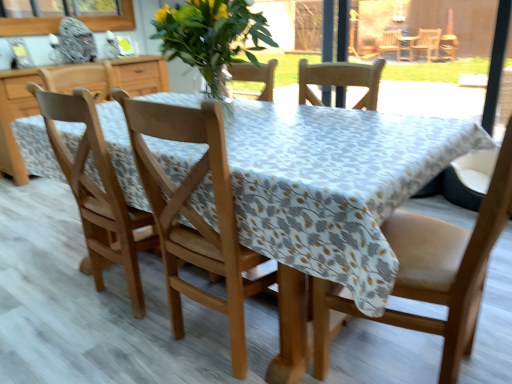
Question: From the image's perspective, is leather at right, marked as the third chair in a left-to-right arrangement, beneath clear glass window screen at upper left?

Choices:
 (A) yes
 (B) no

Answer: (A)

Question: Does leather at right, placed as the first chair when sorted from right to left, have a greater height compared to clear glass window screen at upper left?

Choices:
 (A) no
 (B) yes

Answer: (B)

Question: Is leather at right, placed as the first chair when sorted from right to left, outside clear glass window screen at upper left?

Choices:
 (A) yes
 (B) no

Answer: (A)

Question: From a real-world perspective, is leather at right, placed as the first chair when sorted from right to left, over clear glass window screen at upper left?

Choices:
 (A) no
 (B) yes

Answer: (A)

Question: Are leather at right, placed as the first chair when sorted from right to left, and clear glass window screen at upper left located far from each other?

Choices:
 (A) no
 (B) yes

Answer: (B)

Question: In the image, is leather at right, placed as the first chair when sorted from right to left, positioned in front of or behind wooden chair at center, marked as the 2th chair in a right-to-left arrangement?

Choices:
 (A) front
 (B) behind

Answer: (A)

Question: From a real-world perspective, is leather at right, marked as the third chair in a left-to-right arrangement, positioned above or below wooden chair at center, the 2th chair viewed from the left?

Choices:
 (A) below
 (B) above

Answer: (A)

Question: Does point (313, 344) appear closer or farther from the camera than point (148, 135)?

Choices:
 (A) farther
 (B) closer

Answer: (A)

Question: Looking at the image, does leather at right, marked as the third chair in a left-to-right arrangement, seem bigger or smaller compared to wooden chair at center, marked as the 2th chair in a right-to-left arrangement?

Choices:
 (A) big
 (B) small

Answer: (A)

Question: From a real-world perspective, is wooden chair at left, which is the third chair from right to left, physically located above or below leather at right, marked as the third chair in a left-to-right arrangement?

Choices:
 (A) above
 (B) below

Answer: (B)

Question: Looking at the image, does wooden chair at left, which is the third chair from right to left, seem bigger or smaller compared to leather at right, marked as the third chair in a left-to-right arrangement?

Choices:
 (A) small
 (B) big

Answer: (A)

Question: From the image's perspective, is wooden chair at left, the 1th chair in the left-to-right sequence, above or below leather at right, placed as the first chair when sorted from right to left?

Choices:
 (A) below
 (B) above

Answer: (B)

Question: In terms of width, does wooden chair at left, which is the third chair from right to left, look wider or thinner when compared to leather at right, placed as the first chair when sorted from right to left?

Choices:
 (A) thin
 (B) wide

Answer: (A)

Question: In terms of width, does clear glass window screen at upper left look wider or thinner when compared to wooden chair at center, marked as the 2th chair in a right-to-left arrangement?

Choices:
 (A) wide
 (B) thin

Answer: (B)

Question: From the image's perspective, is clear glass window screen at upper left positioned above or below wooden chair at center, marked as the 2th chair in a right-to-left arrangement?

Choices:
 (A) above
 (B) below

Answer: (A)